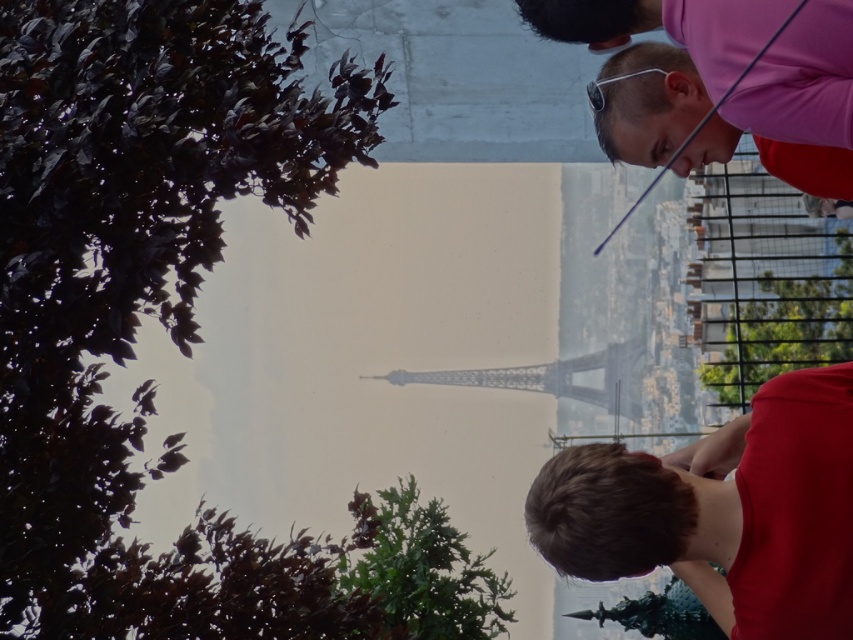
You are a photographer trying to capture the Eiffel Tower in the background with the two people in the foreground. Based on the scene, can you confirm if the brown hair at lower right is positioned in front of the metallic gray Eiffel Tower at center?

The brown hair at lower right is below the metallic gray Eiffel Tower at center, so it is positioned in front of the tower.

You are standing at the Eiffel Tower and looking at the two points marked in the image. Which point, point (820, 381) or point (585, 355), is closer to you?

Point (820, 381) is closer to the viewer than point (585, 355).